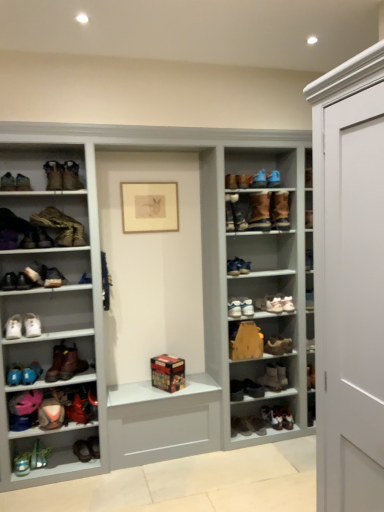
Question: Can you confirm if shiny black sneakers at lower center, which ranks as the 4th footwear in bottom-to-top order, is wider than white leather sneakers at center, arranged as the ninth shoe when viewed from the left?

Choices:
 (A) no
 (B) yes

Answer: (A)

Question: Is shiny black sneakers at lower center, which appears as the seventeenth footwear when viewed from the top, to the right of white leather sneakers at center, which ranks as the 3th shoe in bottom-to-top order, from the viewer's perspective?

Choices:
 (A) yes
 (B) no

Answer: (A)

Question: Is shiny black sneakers at lower center, which appears as the seventeenth footwear when viewed from the top, positioned before white leather sneakers at center, arranged as the ninth shoe when viewed from the left?

Choices:
 (A) yes
 (B) no

Answer: (B)

Question: Considering the relative positions of shiny black sneakers at lower center, which ranks as the 4th footwear in bottom-to-top order, and white leather sneakers at center, which ranks as the 3th shoe in bottom-to-top order, in the image provided, is shiny black sneakers at lower center, which ranks as the 4th footwear in bottom-to-top order, to the left of white leather sneakers at center, which ranks as the 3th shoe in bottom-to-top order, from the viewer's perspective?

Choices:
 (A) yes
 (B) no

Answer: (B)

Question: Can we say shiny black sneakers at lower center, which ranks as the 4th footwear in bottom-to-top order, lies outside white leather sneakers at center, which ranks as the 3th shoe in bottom-to-top order?

Choices:
 (A) no
 (B) yes

Answer: (B)

Question: In terms of size, does matte yellow cabinet at center appear bigger or smaller than matte black shoe at left, acting as the 4th shoe starting from the bottom?

Choices:
 (A) big
 (B) small

Answer: (A)

Question: Considering the positions of point (258, 355) and point (34, 281), is point (258, 355) closer or farther from the camera than point (34, 281)?

Choices:
 (A) closer
 (B) farther

Answer: (B)

Question: In the image, is matte yellow cabinet at center on the left side or the right side of matte black shoe at left, the 6th shoe positioned from the top?

Choices:
 (A) right
 (B) left

Answer: (A)

Question: From the image's perspective, is matte yellow cabinet at center above or below matte black shoe at left, the ninth shoe when ordered from right to left?

Choices:
 (A) below
 (B) above

Answer: (A)

Question: Choose the correct answer: Is wooden box at center inside brown suede boot at upper left, arranged as the 20th footwear when ordered from the bottom, or outside it?

Choices:
 (A) inside
 (B) outside

Answer: (B)

Question: Is point (175, 366) positioned closer to the camera than point (61, 181)?

Choices:
 (A) closer
 (B) farther

Answer: (B)

Question: Considering the positions of wooden box at center and brown suede boot at upper left, arranged as the 20th footwear when ordered from the bottom, in the image, is wooden box at center wider or thinner than brown suede boot at upper left, arranged as the 20th footwear when ordered from the bottom,?

Choices:
 (A) wide
 (B) thin

Answer: (B)

Question: Is wooden box at center in front of or behind brown suede boot at upper left, which is counted as the 1th footwear, starting from the top, in the image?

Choices:
 (A) front
 (B) behind

Answer: (B)

Question: Considering the relative positions of leather boot at left, which is the seventeenth footwear from bottom to top, and brown suede boot at center-right, the tenth footwear from the top, in the image provided, is leather boot at left, which is the seventeenth footwear from bottom to top, to the left or to the right of brown suede boot at center-right, the tenth footwear from the top,?

Choices:
 (A) right
 (B) left

Answer: (B)

Question: From the image's perspective, is leather boot at left, the 4th footwear positioned from the top, located above or below brown suede boot at center-right, the tenth footwear from the top?

Choices:
 (A) below
 (B) above

Answer: (B)